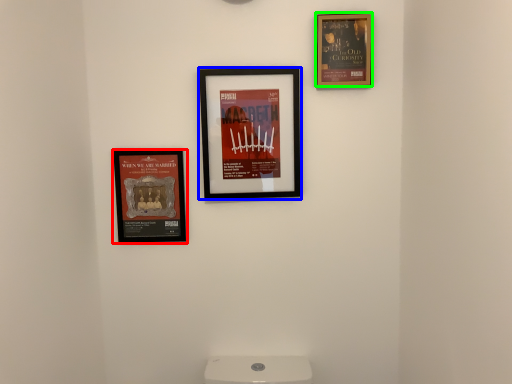
Question: Estimate the real-world distances between objects in this image. Which object is farther from picture frame (highlighted by a red box), picture frame (highlighted by a blue box) or picture frame (highlighted by a green box)?

Choices:
 (A) picture frame
 (B) picture frame

Answer: (B)